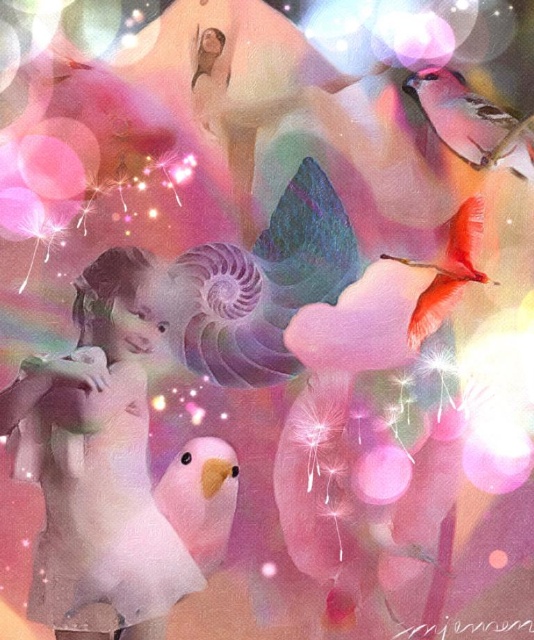
Question: Among these points, which one is nearest to the camera?

Choices:
 (A) (480, 230)
 (B) (434, 81)
 (C) (198, 480)

Answer: (B)

Question: Does pink matte bird at lower left appear over matte pink flamingo at upper right?

Choices:
 (A) no
 (B) yes

Answer: (A)

Question: Is pink matte bird at lower left behind matte pink flamingo at upper right?

Choices:
 (A) no
 (B) yes

Answer: (A)

Question: Can you confirm if matte pink parrot at upper right is wider than matte pink flamingo at upper right?

Choices:
 (A) no
 (B) yes

Answer: (B)

Question: Which object is positioned closest to the matte pink parrot at upper right?

Choices:
 (A) matte pink flamingo at upper right
 (B) pink matte bird at lower left

Answer: (A)

Question: Which point is farther to the camera?

Choices:
 (A) pink matte bird at lower left
 (B) matte pink parrot at upper right

Answer: (B)